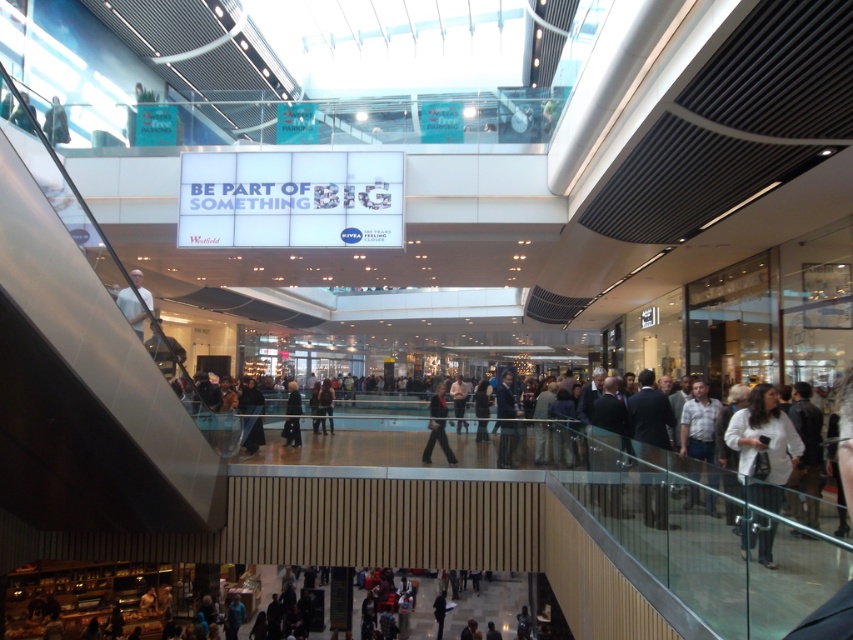
Locate an element on the screen. white matte jacket at lower right is located at coordinates (764, 445).

Between white matte jacket at lower right and dark gray suit at center, which one has more height?

white matte jacket at lower right

Is point (746, 476) behind point (438, 392)?

No, (746, 476) is in front of (438, 392).

The width and height of the screenshot is (853, 640). I want to click on white matte jacket at lower right, so click(764, 445).

Is dark gray suit at center smaller than black fabric at center?

Correct, dark gray suit at center occupies less space than black fabric at center.

Does point (430, 419) come in front of point (297, 428)?

That is True.

Between point (434, 412) and point (294, 390), which one is positioned in front?

Positioned in front is point (434, 412).

Identify the location of dark gray suit at center. This screenshot has height=640, width=853. (437, 426).

Between white matte jacket at lower right and black fabric at center, which one has less height?

white matte jacket at lower right

Can you confirm if white matte jacket at lower right is smaller than black fabric at center?

Correct, white matte jacket at lower right occupies less space than black fabric at center.

Find the location of `white matte jacket at lower right`. white matte jacket at lower right is located at coordinates (764, 445).